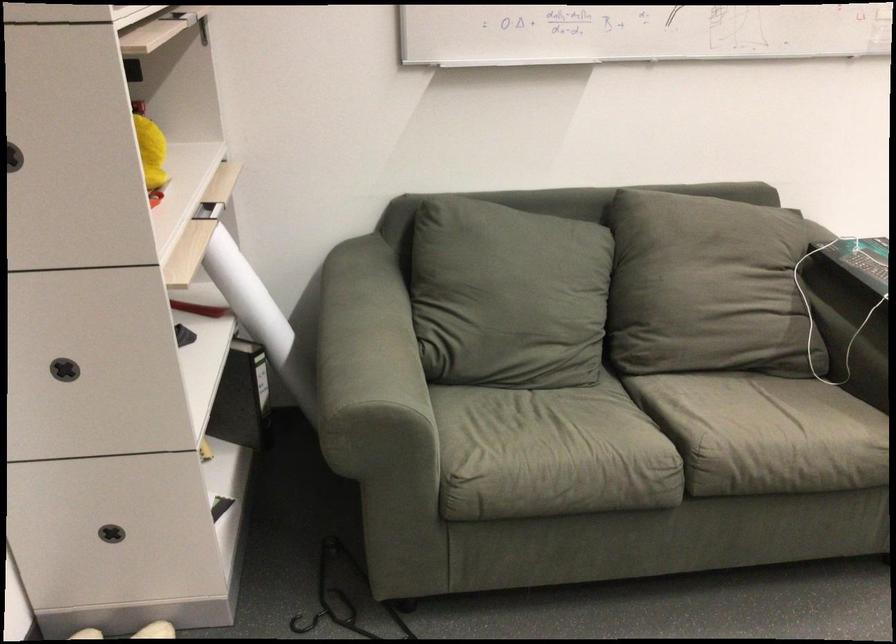
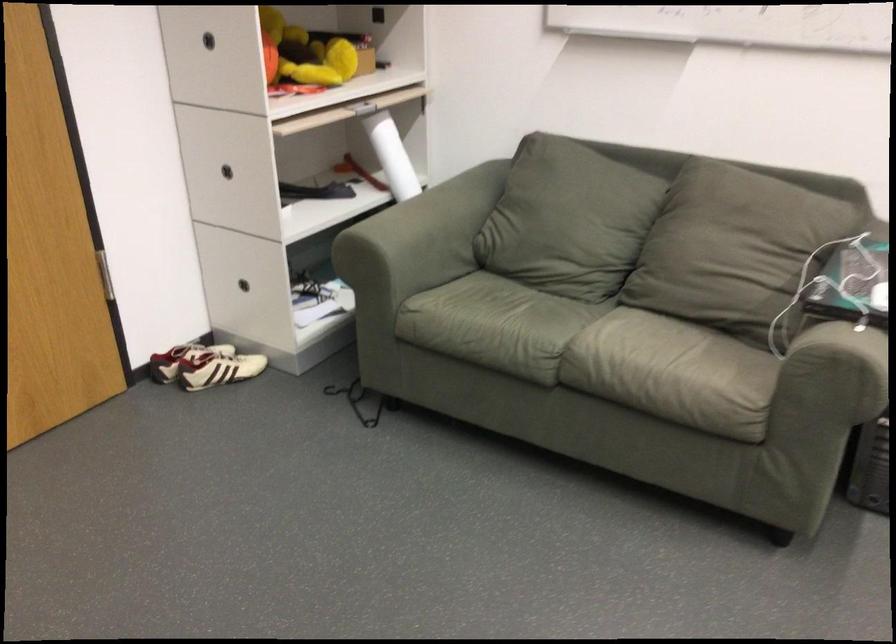
The point at [115,518] is marked in the first image. Where is the corresponding point in the second image?

(252, 283)